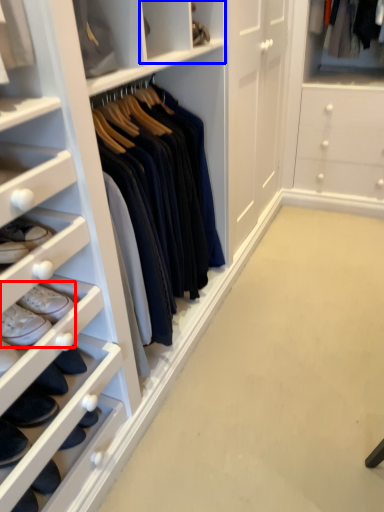
Question: Which object appears closest to the camera in this image, footwear (highlighted by a red box) or cabinet (highlighted by a blue box)?

Choices:
 (A) footwear
 (B) cabinet

Answer: (A)